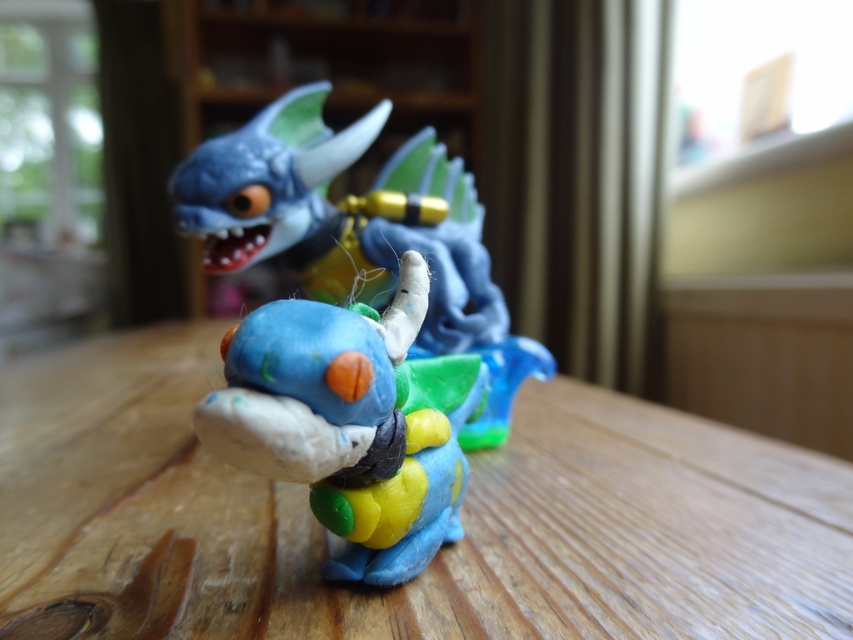
You are organizing a toy collection and need to place a new toy on the wooden table at center. However, there is already a matte plastic toy at center on the table. Based on their positions, can you determine if there is enough space to place the new toy next to the existing one?

The wooden table at center is to the left of matte plastic toy at center, which means the table extends beyond the toy on the left side. There should be enough space to place the new toy next to the existing one on the left side of the matte plastic toy at center.

You are setting up a display and need to place a small decorative item between the wooden table at center and the matte plastic toy at center. The item is 10 inches long. Will there be enough space to place it between them?

The wooden table at center and matte plastic toy at center are 17.32 inches apart, so yes, there is enough space to place a 10 inch long decorative item between them.

You are trying to place a new small figurine on the wooden table at center. However, there is already a matte plastic toy at center. Can you place the new figurine there without moving the existing toy?

The wooden table at center is positioned under matte plastic toy at center, which means the toy is already occupying the space on the table. Therefore, you cannot place the new figurine there without moving the existing toy.